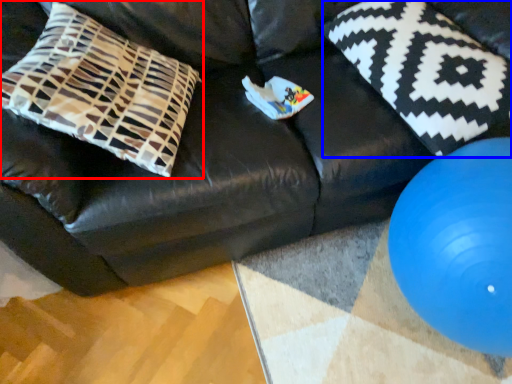
Question: Which object is further to the camera taking this photo, pillow (highlighted by a red box) or pillow (highlighted by a blue box)?

Choices:
 (A) pillow
 (B) pillow

Answer: (B)